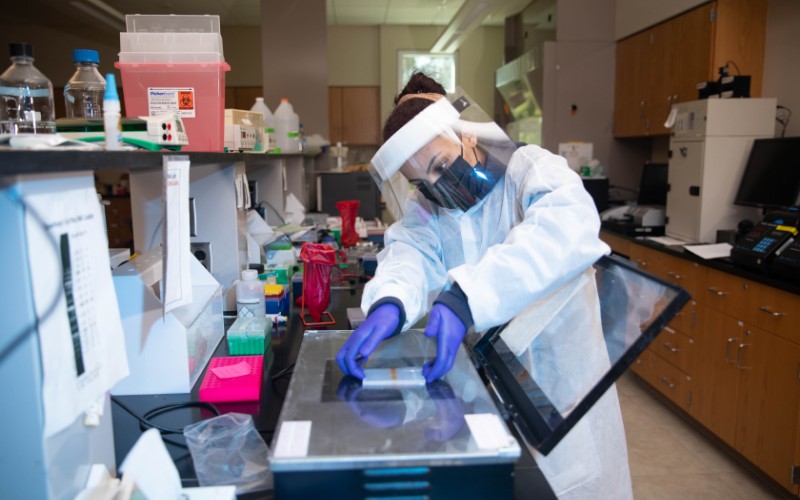
The width and height of the screenshot is (800, 500). Identify the location of liquid jugs. (40, 90), (85, 85), (288, 114), (258, 113), (252, 298).